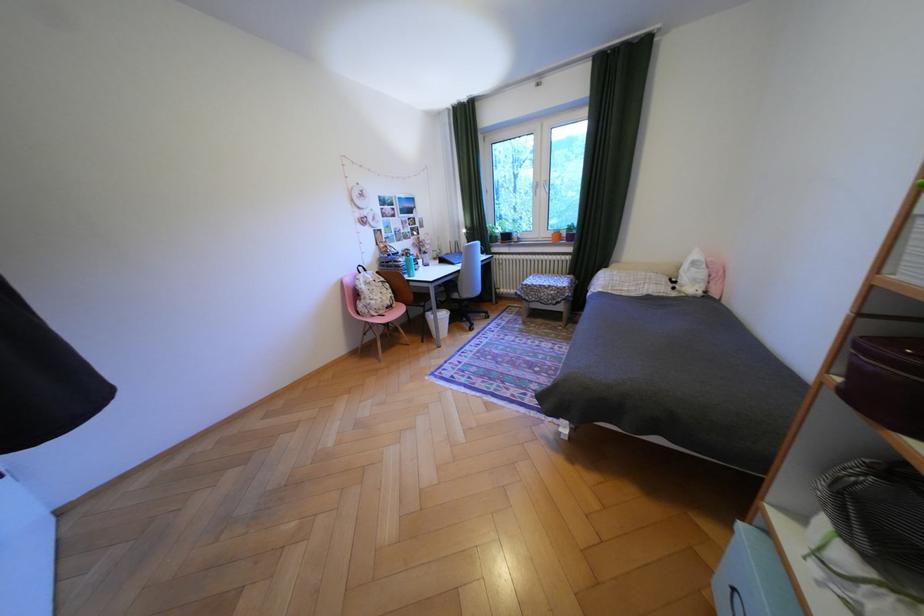
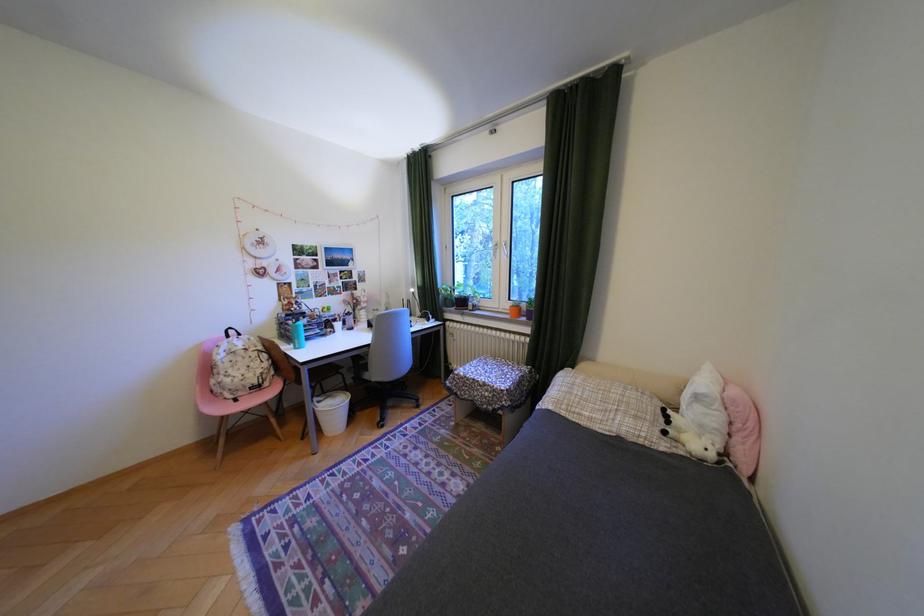
Find the pixel in the second image that matches [539,299] in the first image.

(470, 392)